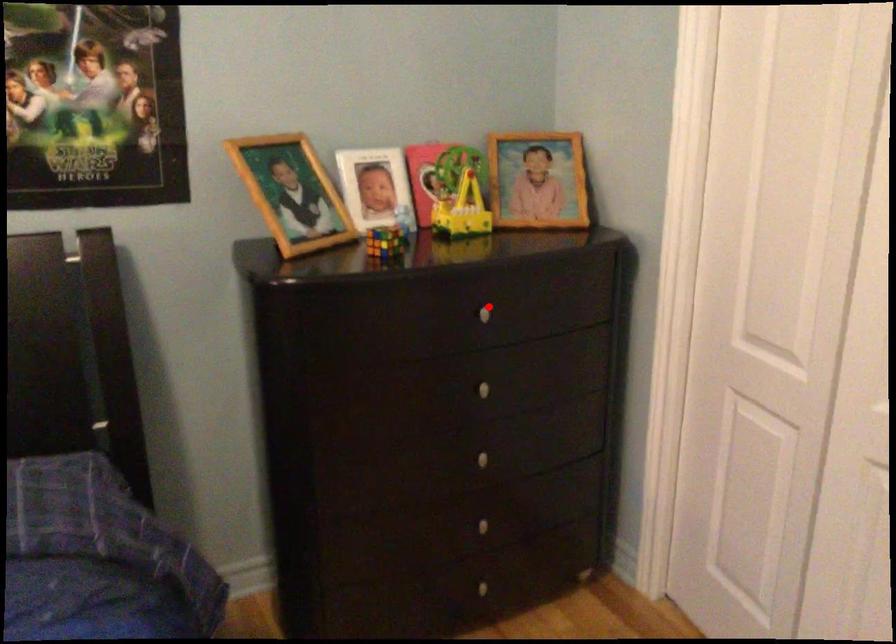
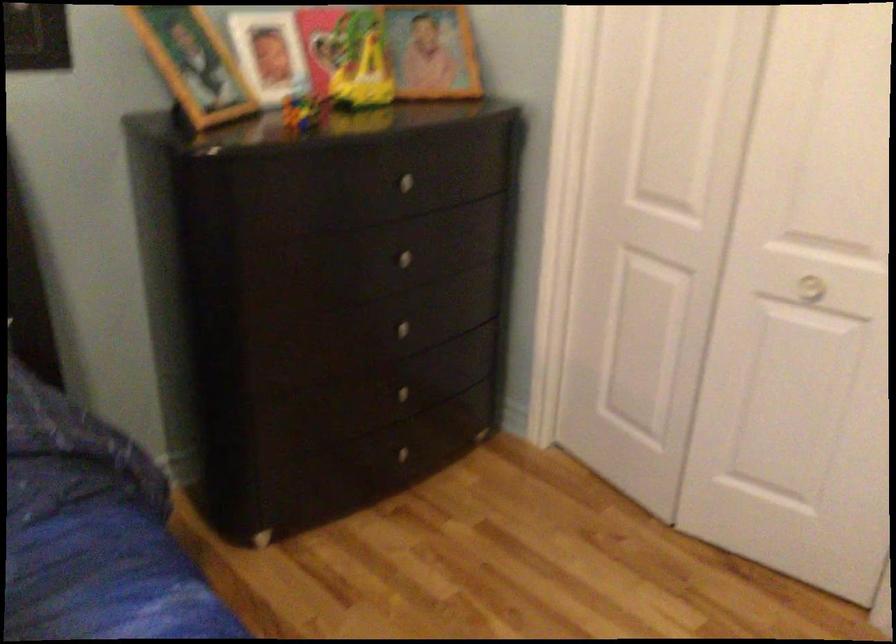
Locate, in the second image, the point that corresponds to the highlighted location in the first image.

(408, 178)